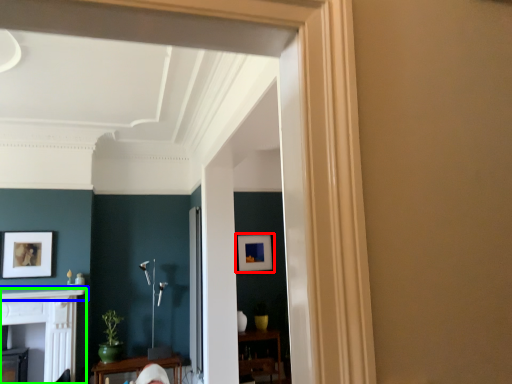
Question: Which is farther away from picture frame (highlighted by a red box)? mantle (highlighted by a blue box) or fireplace (highlighted by a green box)?

Choices:
 (A) mantle
 (B) fireplace

Answer: (B)